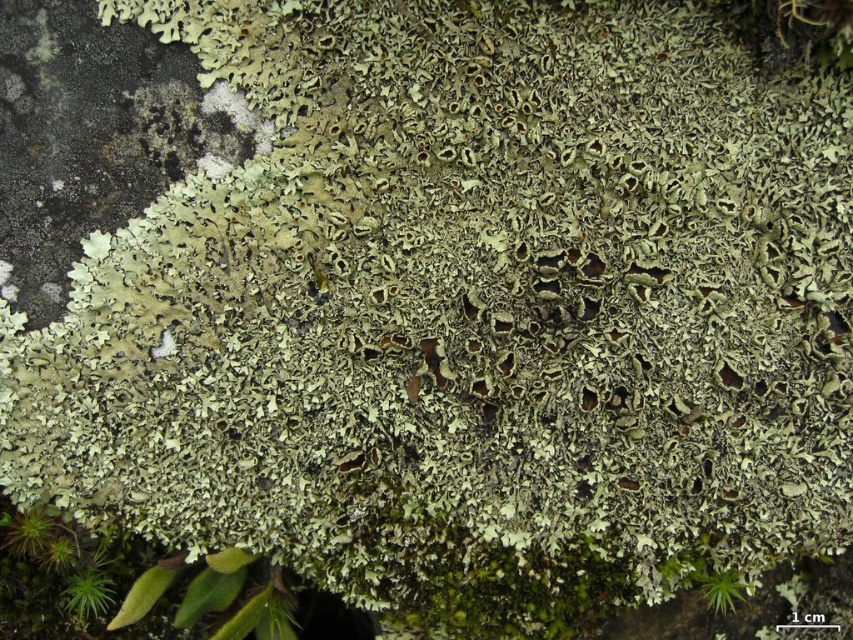
Question: Among these objects, which one is farthest from the camera?

Choices:
 (A) green fuzzy moss at lower right
 (B) green fuzzy moss at lower left

Answer: (B)

Question: Which point is farther from the camera taking this photo?

Choices:
 (A) (695, 580)
 (B) (106, 596)

Answer: (B)

Question: Is green fuzzy moss at lower left smaller than green fuzzy moss at lower right?

Choices:
 (A) no
 (B) yes

Answer: (B)

Question: From the image, what is the correct spatial relationship of green fuzzy moss at lower left in relation to green fuzzy moss at lower right?

Choices:
 (A) below
 (B) above

Answer: (A)

Question: Which point appears farthest from the camera in this image?

Choices:
 (A) (85, 602)
 (B) (728, 572)

Answer: (A)

Question: From the image, what is the correct spatial relationship of green fuzzy moss at lower left in relation to green fuzzy moss at lower right?

Choices:
 (A) right
 (B) left

Answer: (B)